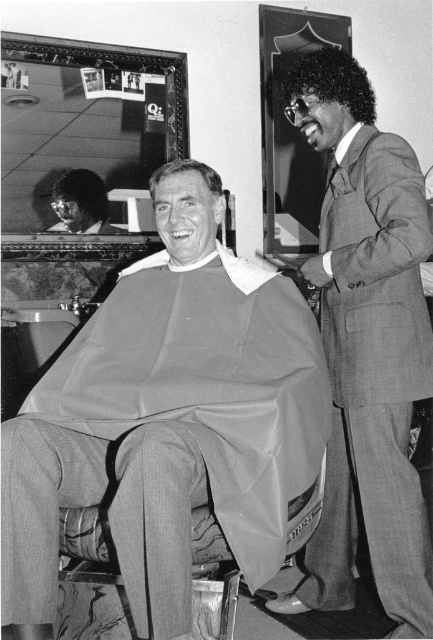
You are a customer entering the barbershop and see the gray fabric at center and the sleek black afro at upper right. Which object is positioned lower in the image?

The gray fabric at center is positioned below the sleek black afro at upper right, so the gray fabric at center is lower.

You are a customer in a barbershop and want to know if there is enough space between the gray fabric at center and the sleek black afro at upper right to comfortably move your hand through. The average human hand is about 7.5 inches wide. Can you fit your hand between them?

The gray fabric at center and sleek black afro at upper right are 37.85 inches apart, which is significantly wider than the average hand width of 7.5 inches. Therefore, you can comfortably fit your hand between them.